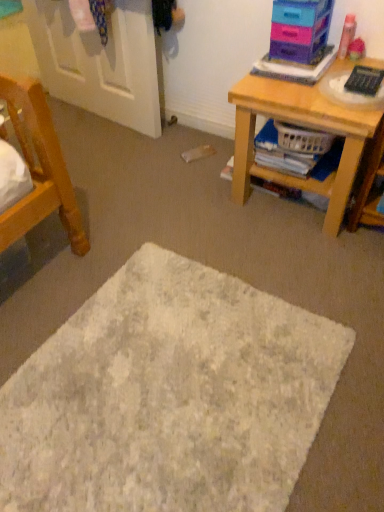
The width and height of the screenshot is (384, 512). Identify the location of vacant space that is to the left of wooden desk at right. [187, 191].